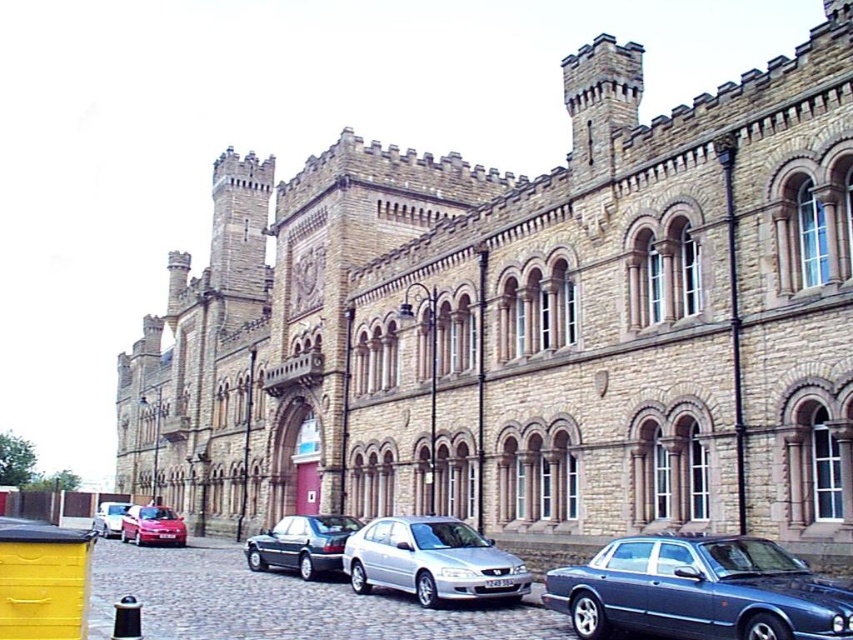
You are a visitor arriving at the historic building and see the metallic blue sedan at lower right and the shiny dark gray sedan at center. Which car is parked higher up relative to the other?

The metallic blue sedan at lower right is above the shiny dark gray sedan at center, so it is parked higher up.

You are a tour guide leading a group to the grand historic building. You notice two sedans in the parking area. The metallic blue sedan at lower right and the silver metallic sedan at center. Which sedan is farther from the grand historic building?

The metallic blue sedan at lower right is farther from the grand historic building than the silver metallic sedan at center because it is positioned at the lower right, which is further away compared to the central position of the silver metallic sedan.

You are a photographer positioned in front of the historic building. You want to capture both the silver metallic sedan at center and the shiny dark gray sedan at center in a single shot. Which car should you focus on to ensure the other is still visible in the background?

You should focus on the silver metallic sedan at center because it is in front of the shiny dark gray sedan at center, so the latter will appear in the background.